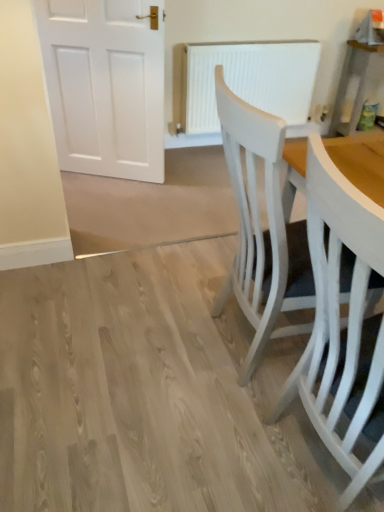
The image size is (384, 512). Identify the location of vacant position to the left of white painted wood chair at right, which ranks as the second chair in front-to-back order. [148, 340].